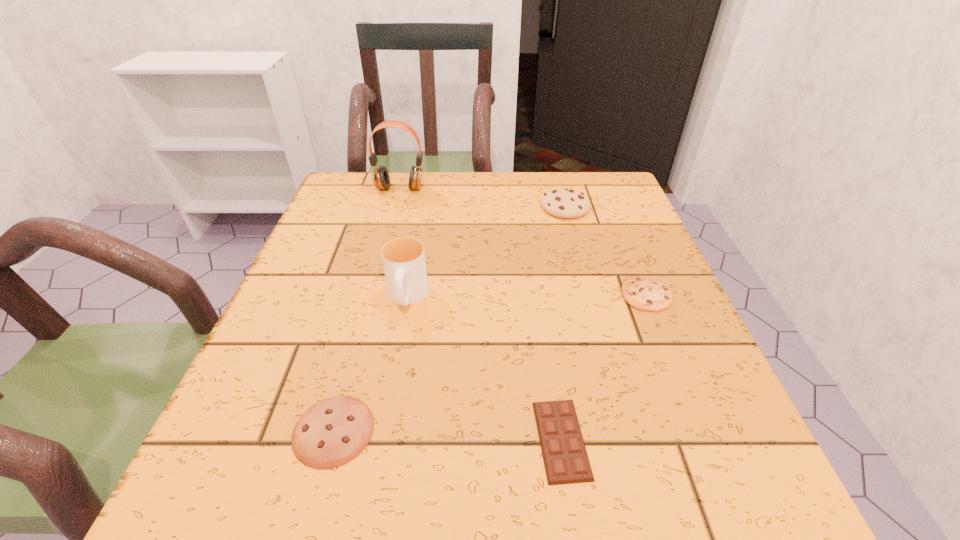
Locate an element on the screen. Image resolution: width=960 pixels, height=540 pixels. cookie that is at the left edge is located at coordinates (332, 432).

Where is `object situated at the far left corner`? This screenshot has height=540, width=960. object situated at the far left corner is located at coordinates (380, 175).

What are the coordinates of `object that is at the near left corner` in the screenshot? It's located at (332, 432).

The width and height of the screenshot is (960, 540). In order to click on object located at the far right corner in this screenshot , I will do `click(564, 203)`.

Image resolution: width=960 pixels, height=540 pixels. In order to click on vacant space at the far edge of the desktop in this screenshot , I will do `click(471, 176)`.

Identify the location of vacant space at the near edge of the desktop. The image size is (960, 540). (435, 472).

In the image, there is a desktop. Find the location of `vacant space at the left edge`. vacant space at the left edge is located at coordinates (272, 417).

In order to click on vacant position at the right edge of the desktop in this screenshot , I will do `click(639, 252)`.

At what (x,y) coordinates should I click in order to perform the action: click on vacant space at the far left corner. Please return your answer as a coordinate pair (x, y). Image resolution: width=960 pixels, height=540 pixels. Looking at the image, I should click on (359, 199).

At what (x,y) coordinates should I click in order to perform the action: click on vacant space at the far right corner of the desktop. Please return your answer as a coordinate pair (x, y). This screenshot has height=540, width=960. Looking at the image, I should click on (592, 183).